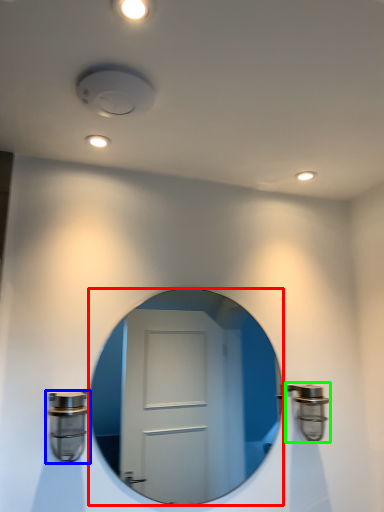
Question: Which is nearer to the mirror (highlighted by a red box)? door handle (highlighted by a blue box) or door handle (highlighted by a green box).

Choices:
 (A) door handle
 (B) door handle

Answer: (B)